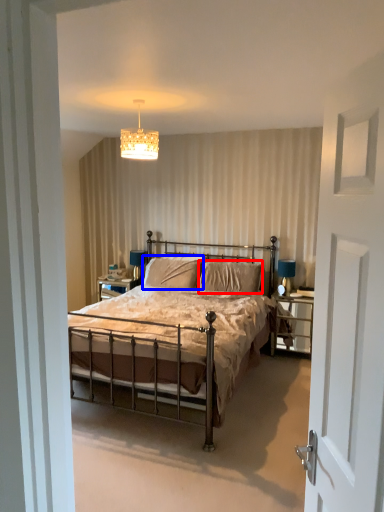
Question: Which point is further to the camera, pillow (highlighted by a red box) or pillow (highlighted by a blue box)?

Choices:
 (A) pillow
 (B) pillow

Answer: (B)